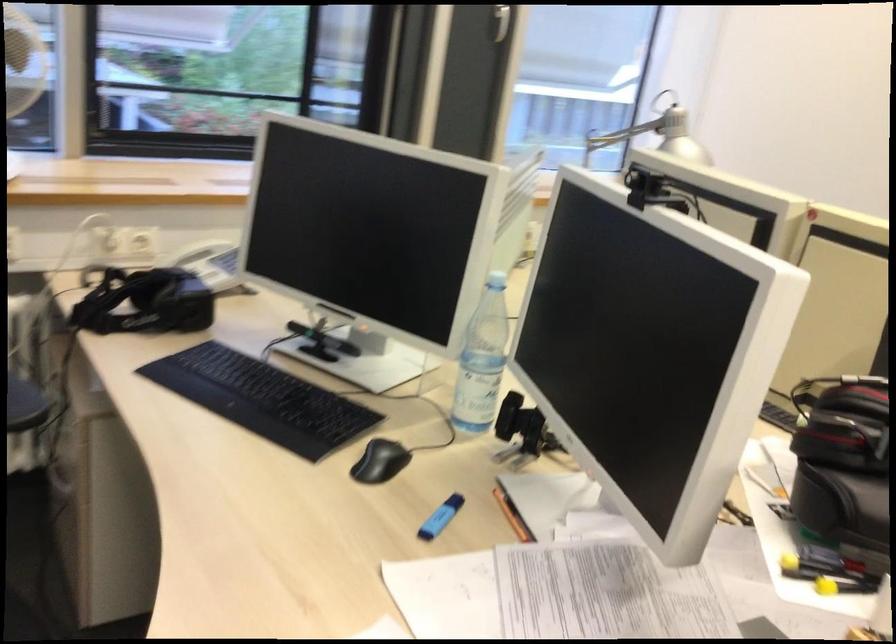
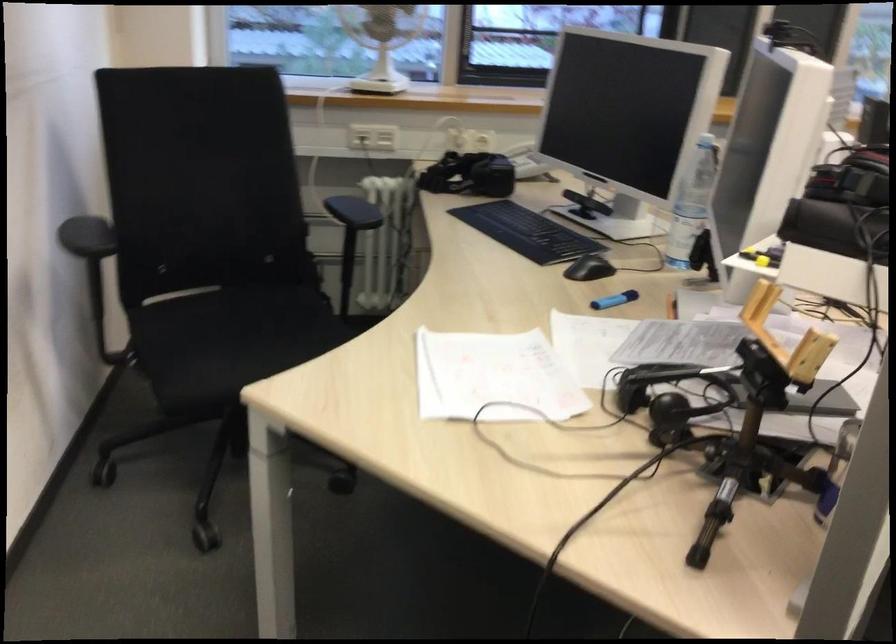
Locate, in the second image, the point that corresponds to point 205,256 in the first image.

(519, 149)